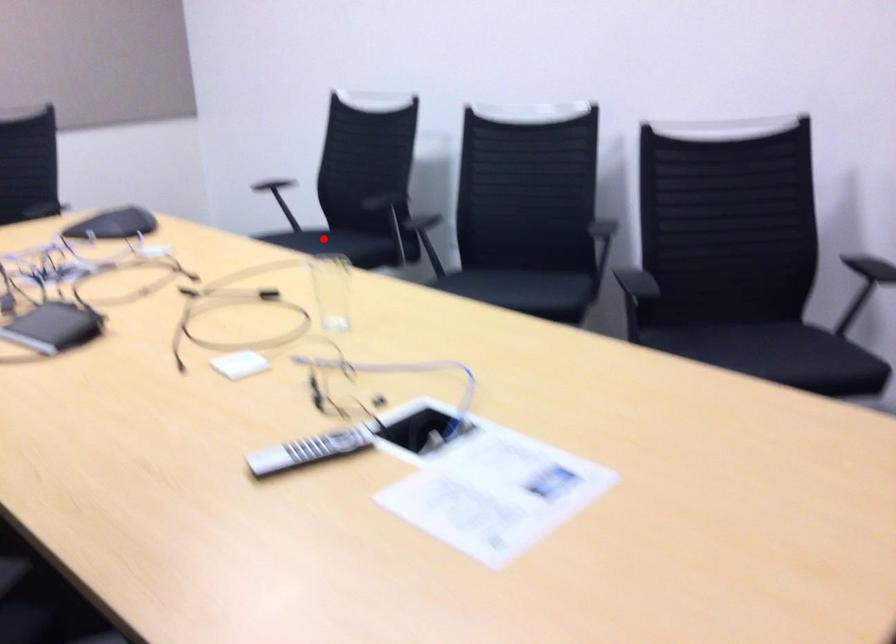
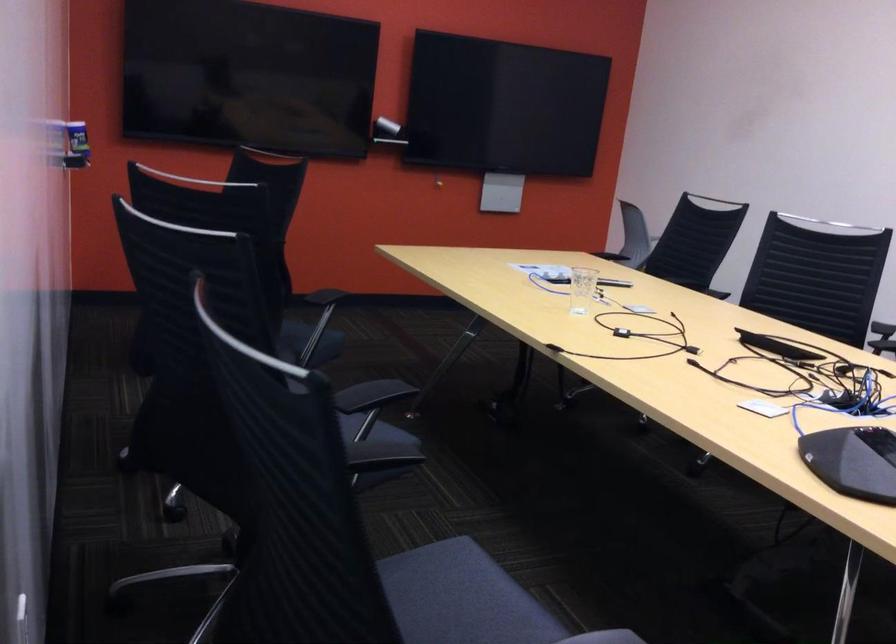
Question: I am providing you with two images of the same scene from different viewpoints. In image1, a red point is highlighted. Considering the same 3D point in image2, which of the following is correct?

Choices:
 (A) It is closer
 (B) It is farther

Answer: (A)